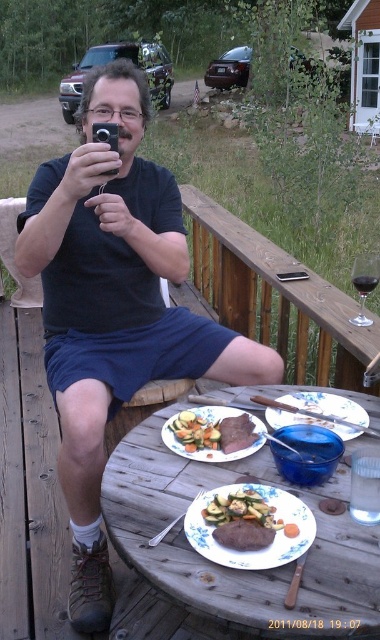
Question: Among these points, which one is nearest to the camera?

Choices:
 (A) (348, 403)
 (B) (98, 448)
 (C) (202, 406)

Answer: (A)

Question: Is matte black phone at upper left positioned at the back of wooden table at center?

Choices:
 (A) yes
 (B) no

Answer: (A)

Question: Estimate the real-world distances between objects in this image. Which object is farther from the white matte plate at center?

Choices:
 (A) golden brown steak at center
 (B) matte black phone at upper left
 (C) wooden table at center
 (D) white ceramic plate at center

Answer: (B)

Question: Can you confirm if matte black phone at upper left is bigger than white matte plate at center?

Choices:
 (A) no
 (B) yes

Answer: (B)

Question: Among these objects, which one is nearest to the camera?

Choices:
 (A) golden brown steak at center
 (B) white ceramic plate at center
 (C) wooden table at center

Answer: (C)

Question: Is wooden table at center above white matte plate at center?

Choices:
 (A) no
 (B) yes

Answer: (B)